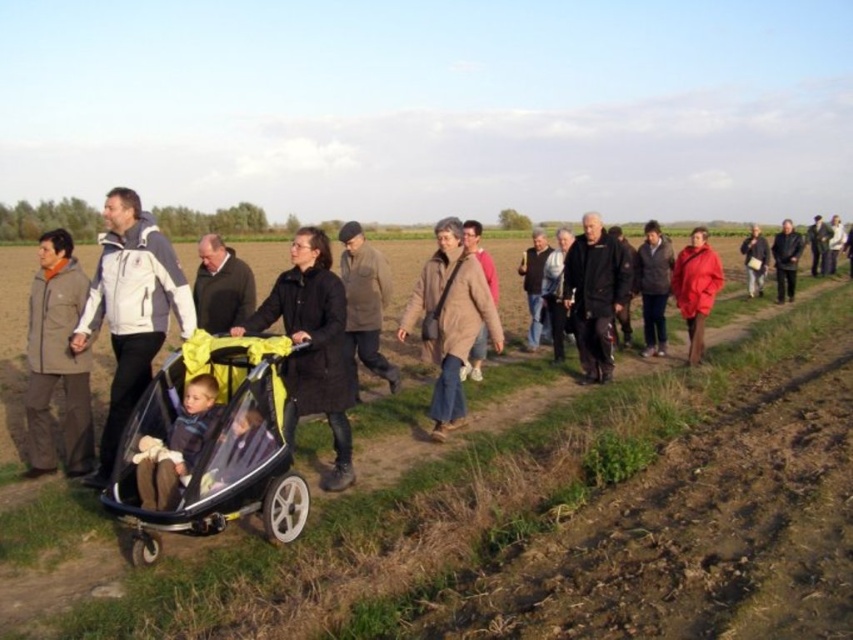
Question: Based on their relative distances, which object is nearer to the white fleece jacket at left?

Choices:
 (A) matte brown jacket at left
 (B) brown woolen coat at center
 (C) transparent plastic baby carriage at center

Answer: (A)

Question: Is matte brown jacket at left above black matte coat at center?

Choices:
 (A) no
 (B) yes

Answer: (A)

Question: Is white fleece jacket at left thinner than matte brown jacket at left?

Choices:
 (A) yes
 (B) no

Answer: (A)

Question: Which point is closer to the camera?

Choices:
 (A) black matte jacket at center
 (B) black matte coat at center

Answer: (B)

Question: Can you confirm if transparent plastic baby carriage at center is smaller than white fleece jacket at left?

Choices:
 (A) no
 (B) yes

Answer: (B)

Question: Which is farther from the black matte jacket at center?

Choices:
 (A) white fleece jacket at left
 (B) brown woolen coat at center
 (C) yellow fabric stroller at center

Answer: (C)